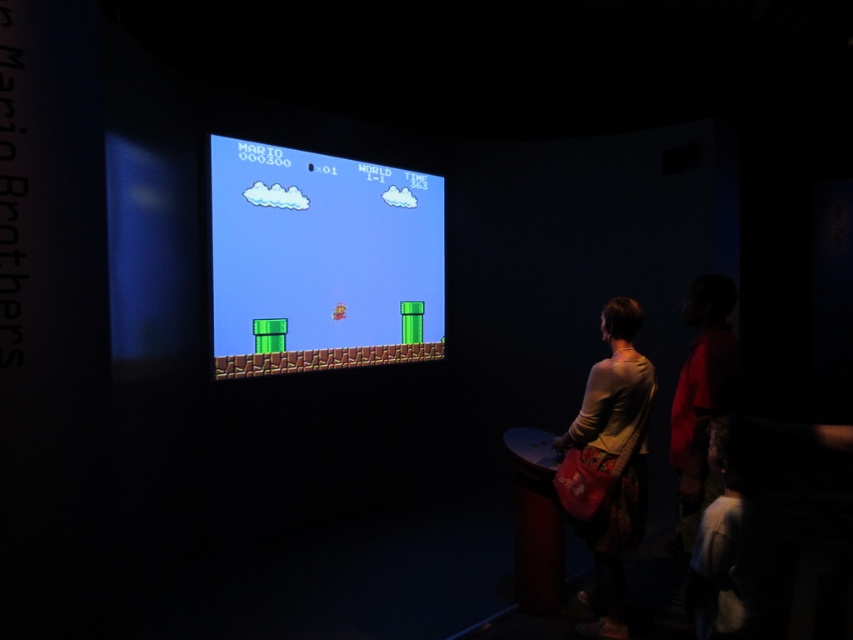
Looking at this image, you are a character in the game and need to jump from point (257,332) to point (596,413). Considering their positions, will you land safely on the second point?

Point (257,332) is further to the camera than point (596,413). Since the second point is closer to you, jumping from a farther point to a closer one might require adjusting your jump trajectory to ensure you land safely on point (596,413).

You are a game developer analyzing the layout of a room where a video game is being displayed. You notice the matte plastic screen at center and the light brown fabric bag at center. Which object is shorter in height?

The matte plastic screen at center has a lesser height compared to the light brown fabric bag at center, so the matte plastic screen at center is shorter in height.

You are holding a light brown fabric bag at center and want to place it on a table next to the matte plastic screen at center. Given that the table can only accommodate items smaller than the screen, will the bag fit?

The matte plastic screen at center is larger in size than the light brown fabric bag at center, so the bag will fit on the table next to the matte plastic screen at center since it is smaller than the screen.